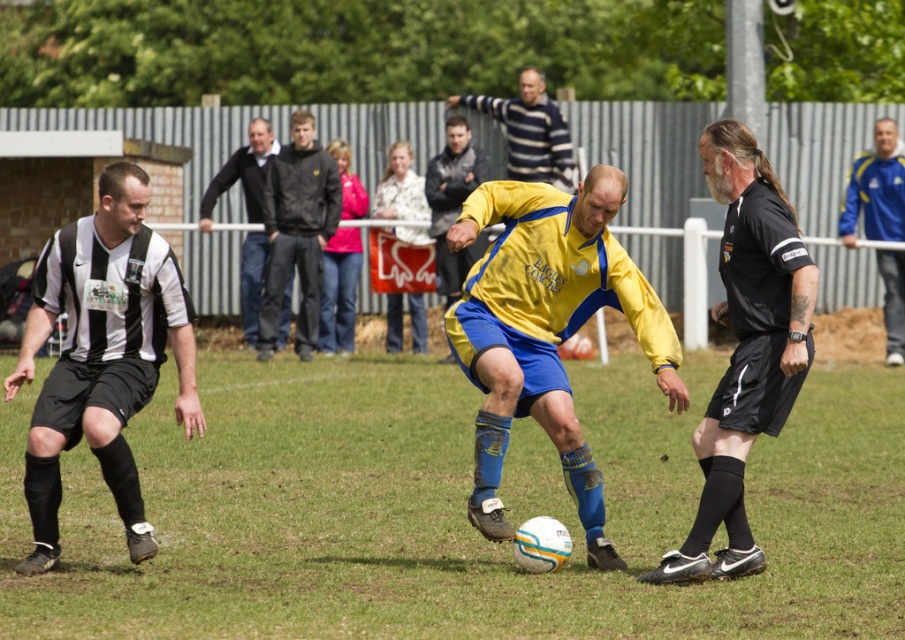
You are a sports commentator describing the players in the soccer match. Which jacket is bigger in size between the black matte jacket at center and the blue synthetic jacket at upper right?

The black matte jacket at center is larger in size compared to the blue synthetic jacket at upper right.

You are standing at the position of the black matte jacket at center. You want to throw a ball to the spectator behind the fence in the background. The fence is 20 meters away from you. Can you reach the fence with a throw? Please explain your reasoning.

The distance between the black matte jacket at center and the viewer is 16.02 meters. Since the fence is 20 meters away from the jacket, the total distance from the viewer to the fence would be 16.02 meters plus 20 meters, totaling 36.02 meters. Most people cannot throw a ball that far, so it would be difficult to reach the fence with a single throw.

You are a soccer player on the field and you see the white matte soccer ball at center and the black jersey at upper center. Which object is positioned to the right side of the other?

The white matte soccer ball at center is to the right of the black jersey at upper center.